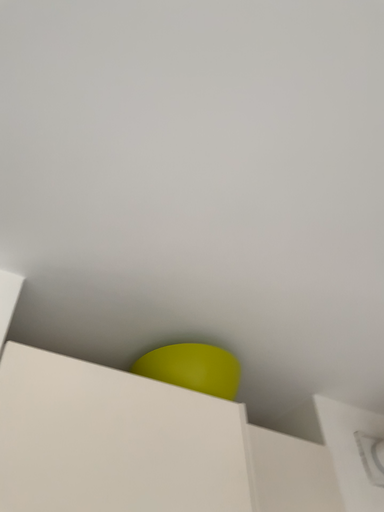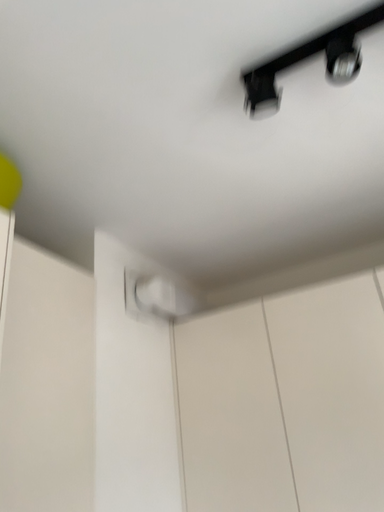
Question: Which way did the camera rotate in the video?

Choices:
 (A) rotated downward
 (B) rotated upward

Answer: (A)